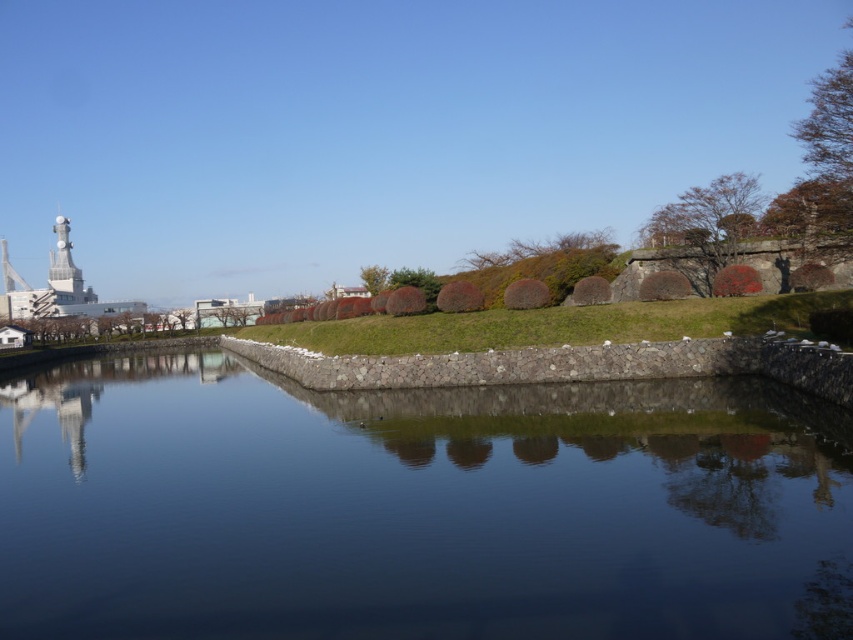
Is dark stone water at center further to camera compared to metallic silver tower at upper left?

That is False.

Between dark stone water at center and metallic silver tower at upper left, which one has more height?

metallic silver tower at upper left

You are a GUI agent. You are given a task and a screenshot of the screen. Output one action in this format:
    pyautogui.click(x=<x>, y=<y>)
    Task: Click on the dark stone water at center
    This screenshot has height=640, width=853.
    Given the screenshot: What is the action you would take?
    pyautogui.click(x=416, y=508)